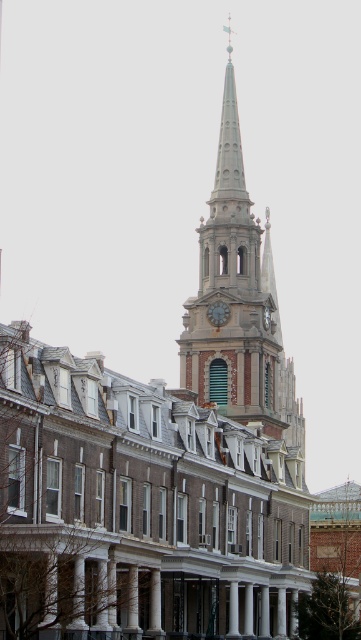
You are a city planner assessing the historic district. You need to install a new 15 meter long decorative light pole between the smooth gray steeple at center and the green stone clock at center. Is there enough space to place it directly between them without moving either structure?

The distance between the smooth gray steeple at center and the green stone clock at center is 20.30 meters. Since the light pole is 15 meters long, there is sufficient space to place it between them without needing to move either structure.

You are standing in the historic urban scene and want to determine which of the two points is closer to you. The points are labeled as point (255,252) and point (210,305). Which point is closer to your current position?

Point (255,252) is further to the viewer than point (210,305), so the closer point to your position is point (210,305).